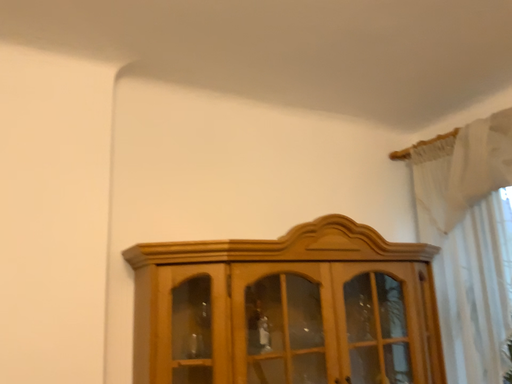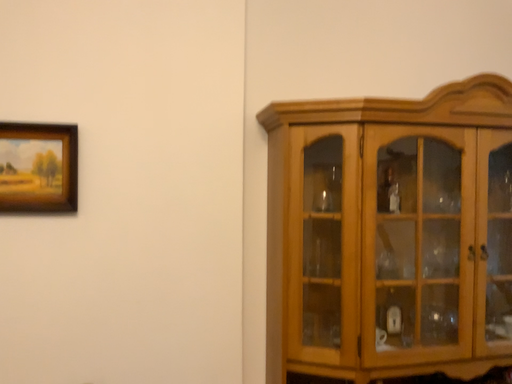
Question: How did the camera likely rotate when shooting the video?

Choices:
 (A) rotated downward
 (B) rotated upward

Answer: (A)